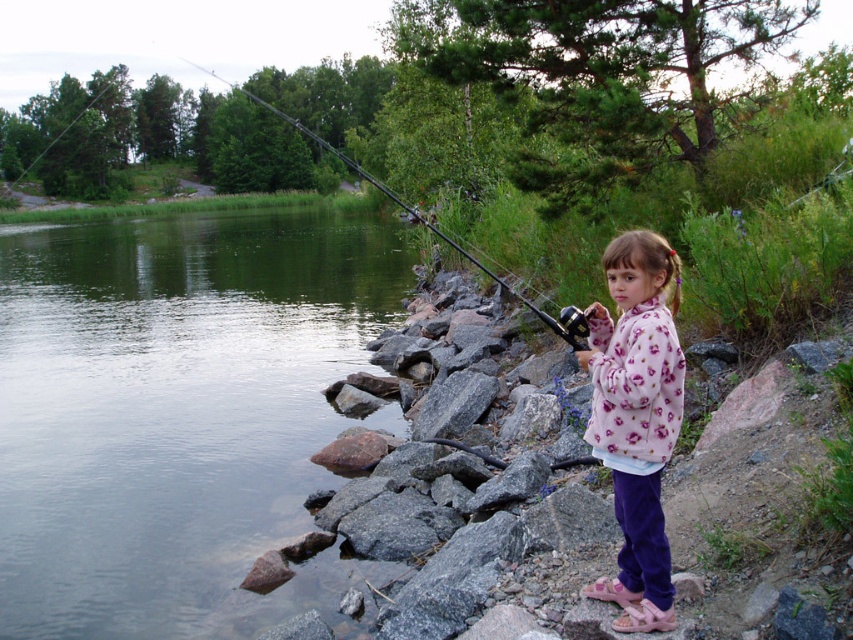
Is green smooth water at left thinner than black metallic fishing pole at upper center?

Correct, green smooth water at left's width is less than black metallic fishing pole at upper center's.

Which of these two, green smooth water at left or black metallic fishing pole at upper center, stands shorter?

green smooth water at left

Is point (155, 406) positioned in front of point (572, 339)?

No, it is behind (572, 339).

At what (x,y) coordinates should I click in order to perform the action: click on green smooth water at left. Please return your answer as a coordinate pair (x, y). Looking at the image, I should click on (177, 413).

The width and height of the screenshot is (853, 640). What do you see at coordinates (636, 419) in the screenshot? I see `fluffy pink sweater at right` at bounding box center [636, 419].

Based on the photo, can you confirm if fluffy pink sweater at right is positioned below black metallic fishing pole at upper center?

Yes, fluffy pink sweater at right is below black metallic fishing pole at upper center.

Which is in front, point (645, 484) or point (204, 70)?

Point (645, 484) is more forward.

Locate an element on the screen. fluffy pink sweater at right is located at coordinates (636, 419).

Can you confirm if green smooth water at left is thinner than fluffy pink sweater at right?

In fact, green smooth water at left might be wider than fluffy pink sweater at right.

Between point (277, 531) and point (643, 301), which one is positioned behind?

The point (277, 531) is behind.

Where is `green smooth water at left`? This screenshot has width=853, height=640. green smooth water at left is located at coordinates (177, 413).